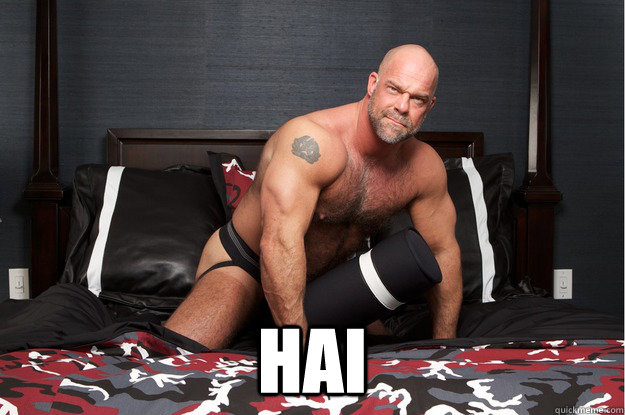
Where is `black, red, white, and grey blanket`? The width and height of the screenshot is (625, 415). black, red, white, and grey blanket is located at coordinates pyautogui.click(x=518, y=374).